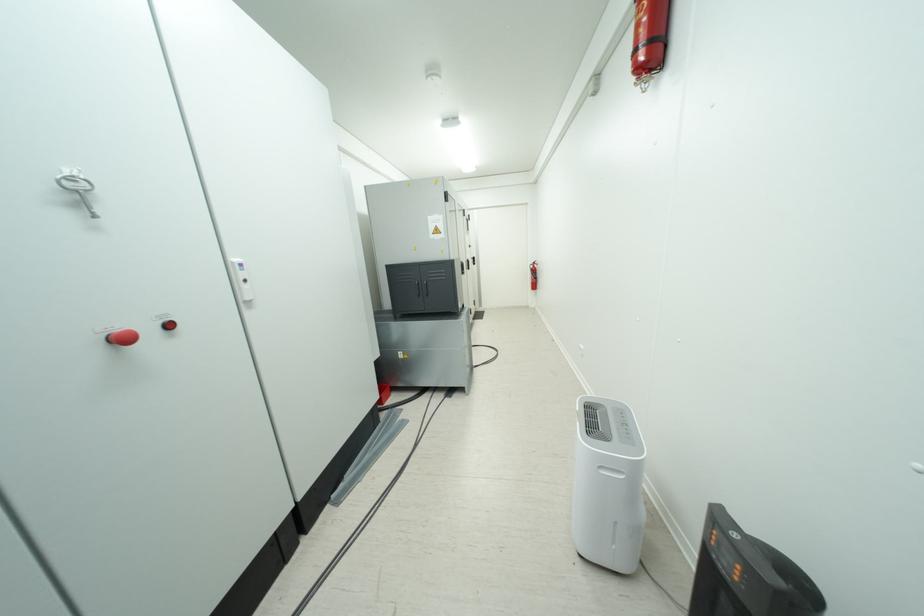
Where would you lift the black device handle? Please return your answer as a coordinate pair (x, y).

(747, 575)